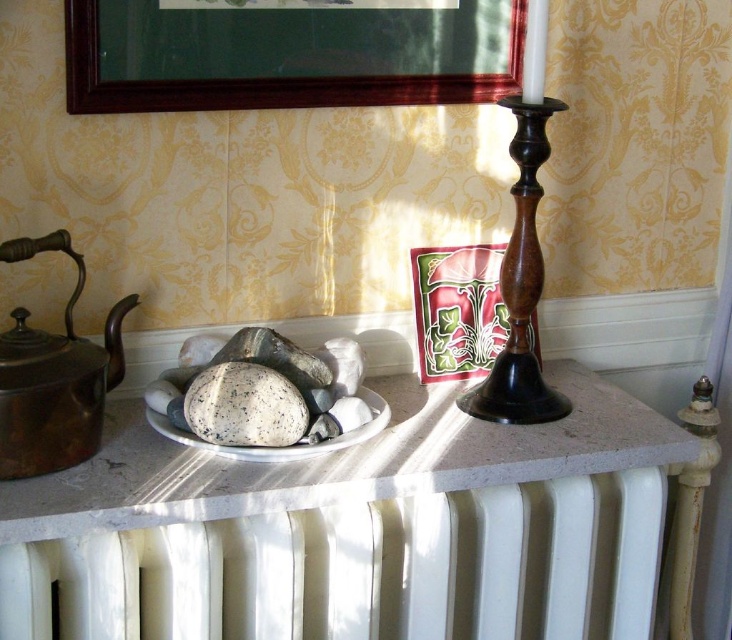
Is shiny brass teapot at left positioned behind speckled stone plate at center?

No, it is in front of speckled stone plate at center.

Who is positioned more to the left, shiny brass teapot at left or speckled stone plate at center?

shiny brass teapot at left

The image size is (732, 640). In order to click on shiny brass teapot at left in this screenshot , I will do `click(53, 378)`.

Between dark wood picture frame at upper center and speckled stone plate at center, which one appears on the left side from the viewer's perspective?

speckled stone plate at center is more to the left.

Identify the location of dark wood picture frame at upper center. The width and height of the screenshot is (732, 640). (287, 54).

Is point (329, 97) positioned behind point (193, 435)?

Yes, it is behind point (193, 435).

Identify the location of dark wood picture frame at upper center. This screenshot has width=732, height=640. (287, 54).

Does speckled marble stone at center appear on the right side of speckled stone plate at center?

No, speckled marble stone at center is not to the right of speckled stone plate at center.

Who is more distant from viewer, (203, 417) or (305, 442)?

Positioned behind is point (305, 442).

What do you see at coordinates (244, 406) in the screenshot? The width and height of the screenshot is (732, 640). I see `speckled marble stone at center` at bounding box center [244, 406].

I want to click on speckled marble stone at center, so click(x=244, y=406).